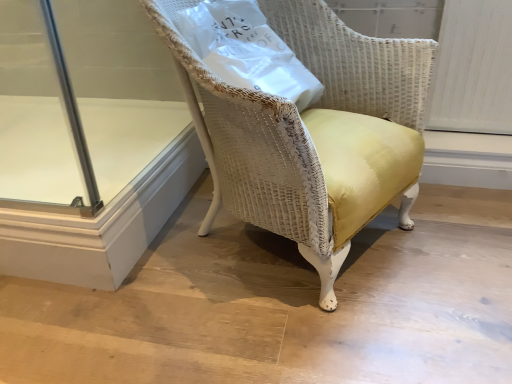
Question: Is white paper bag at upper center in front of or behind transparent glass door at lower left in the image?

Choices:
 (A) behind
 (B) front

Answer: (B)

Question: Would you say white paper bag at upper center is to the left or to the right of transparent glass door at lower left in the picture?

Choices:
 (A) right
 (B) left

Answer: (A)

Question: Which object is the farthest from the white paper bag at upper center?

Choices:
 (A) yellow fabric chair at center
 (B) transparent glass door at lower left

Answer: (B)

Question: Which object is positioned farthest from the yellow fabric chair at center?

Choices:
 (A) transparent glass door at lower left
 (B) white paper bag at upper center

Answer: (A)